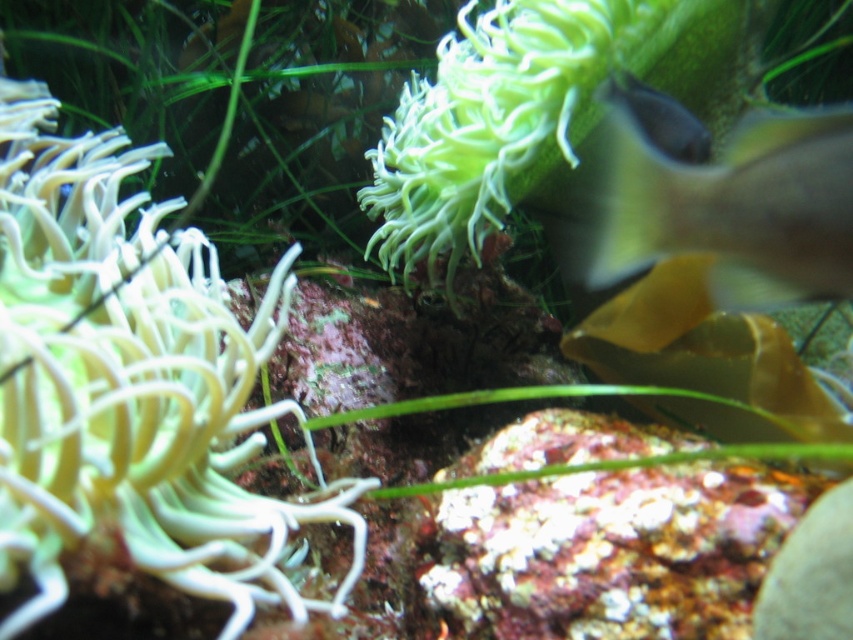
Does white soft coral at left appear under translucent yellow fish at right?

Yes, white soft coral at left is below translucent yellow fish at right.

Which is more to the right, white soft coral at left or translucent yellow fish at right?

translucent yellow fish at right is more to the right.

I want to click on white soft coral at left, so click(x=131, y=384).